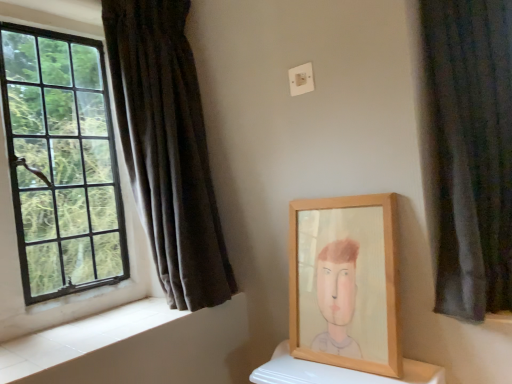
Question: Considering the positions of dark velvet curtain at right, arranged as the 1th curtain when viewed from the front, and wooden frame at center in the image, is dark velvet curtain at right, arranged as the 1th curtain when viewed from the front, bigger or smaller than wooden frame at center?

Choices:
 (A) small
 (B) big

Answer: (B)

Question: Is point (467, 9) closer or farther from the camera than point (396, 340)?

Choices:
 (A) farther
 (B) closer

Answer: (A)

Question: Which is nearer to the dark velvet curtain at left, the 2th curtain in the right-to-left sequence?

Choices:
 (A) white tile at lower left
 (B) wooden frame at center
 (C) black glass window at left
 (D) dark velvet curtain at right, arranged as the 1th curtain when viewed from the front

Answer: (C)

Question: Which object is positioned farthest from the dark velvet curtain at left, which appears as the 2th curtain when viewed from the front?

Choices:
 (A) black glass window at left
 (B) white tile at lower left
 (C) wooden frame at center
 (D) dark velvet curtain at right, the 2th curtain in the left-to-right sequence

Answer: (D)